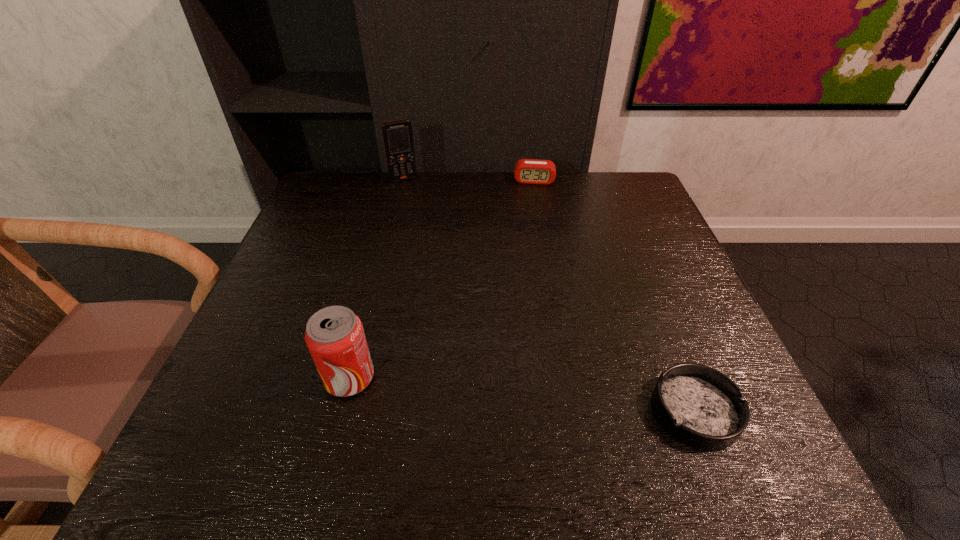
You are a GUI agent. You are given a task and a screenshot of the screen. Output one action in this format:
    pyautogui.click(x=<x>, y=<y>)
    Task: Click on the vacant area at the far edge of the desktop
    
    Given the screenshot: What is the action you would take?
    pyautogui.click(x=432, y=172)

At what (x,y) coordinates should I click in order to perform the action: click on vacant area at the near edge of the desktop. Please return your answer as a coordinate pair (x, y). Looking at the image, I should click on (565, 386).

The height and width of the screenshot is (540, 960). Identify the location of vacant space at the left edge. (324, 241).

Identify the location of vacant space at the right edge of the desktop. (614, 236).

You are a GUI agent. You are given a task and a screenshot of the screen. Output one action in this format:
    pyautogui.click(x=<x>, y=<y>)
    Task: Click on the free point at the far left corner
    
    Given the screenshot: What is the action you would take?
    pyautogui.click(x=323, y=181)

Locate an element on the screen. This screenshot has width=960, height=540. vacant point located between the soda can and the ashtray is located at coordinates (522, 394).

The height and width of the screenshot is (540, 960). Find the location of `free space between the shortest object and the alarm clock`. free space between the shortest object and the alarm clock is located at coordinates (614, 296).

The image size is (960, 540). Identify the location of vacant space that's between the cellular telephone and the alarm clock. (468, 180).

Find the location of a particular element. Image resolution: width=960 pixels, height=540 pixels. vacant space that is in between the cellular telephone and the shortest object is located at coordinates (549, 295).

The width and height of the screenshot is (960, 540). Find the location of `vacant space that's between the soda can and the shortest object`. vacant space that's between the soda can and the shortest object is located at coordinates (522, 394).